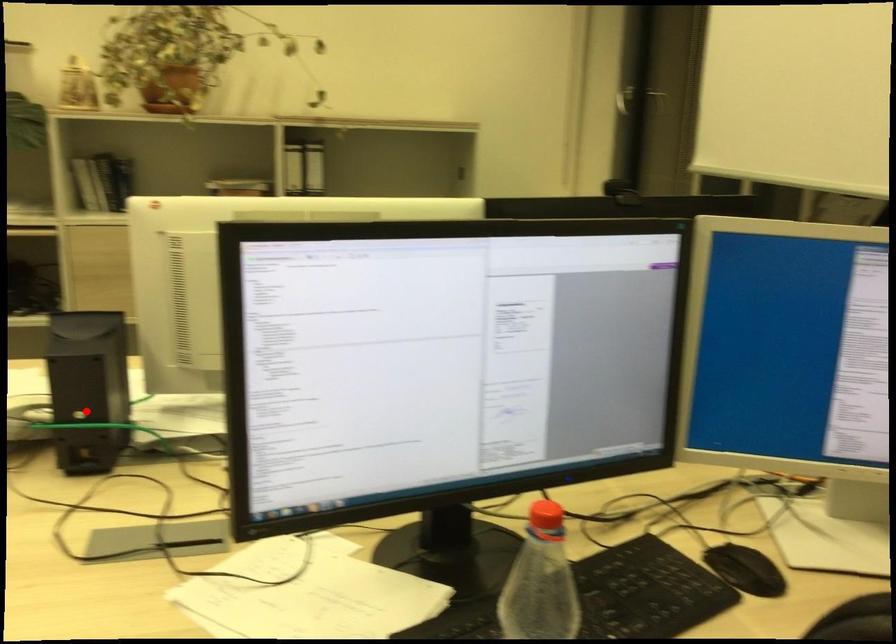
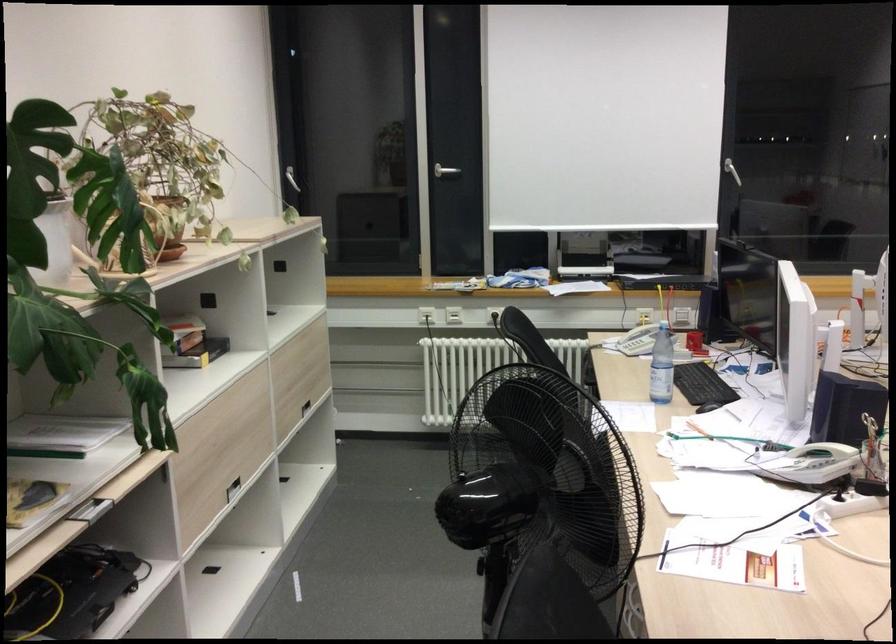
Find the pixel in the second image that matches the highlighted location in the first image.

(814, 464)